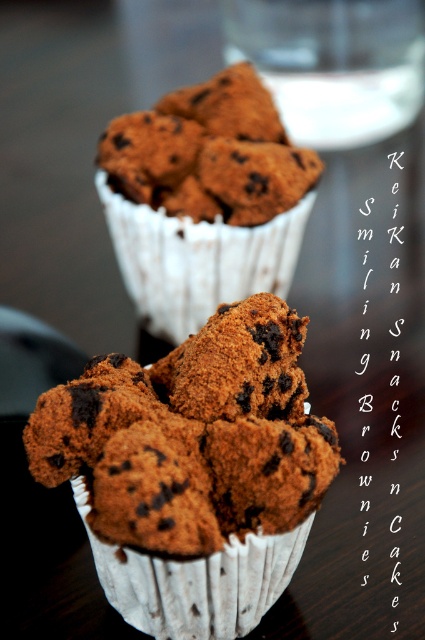
Question: Which point is farther to the camera?

Choices:
 (A) chocolate-coated muffin at center
 (B) brown matte chocolate chip muffin at center

Answer: (B)

Question: Which object is farther from the camera taking this photo?

Choices:
 (A) brown matte chocolate chip muffin at center
 (B) chocolate-coated muffin at center

Answer: (A)

Question: Is chocolate-coated muffin at center to the left of brown matte chocolate chip muffin at center from the viewer's perspective?

Choices:
 (A) no
 (B) yes

Answer: (B)

Question: Does chocolate-coated muffin at center come in front of brown matte chocolate chip muffin at center?

Choices:
 (A) yes
 (B) no

Answer: (A)

Question: Does chocolate-coated muffin at center have a smaller size compared to brown matte chocolate chip muffin at center?

Choices:
 (A) no
 (B) yes

Answer: (B)